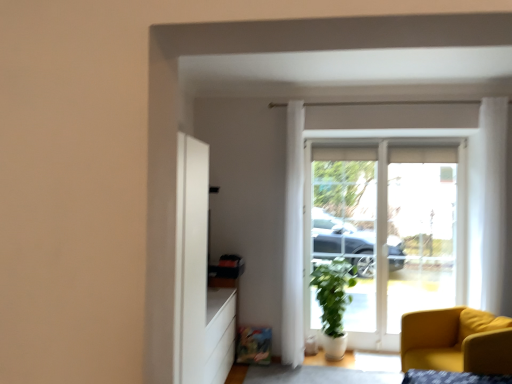
You are a GUI agent. You are given a task and a screenshot of the screen. Output one action in this format:
    pyautogui.click(x=<x>, y=<y>)
    Task: Click on the free region under white sheer curtain at center, arranged as the second curtain when viewed from the front (from a real-world perspective)
    
    Given the screenshot: What is the action you would take?
    pyautogui.click(x=291, y=365)